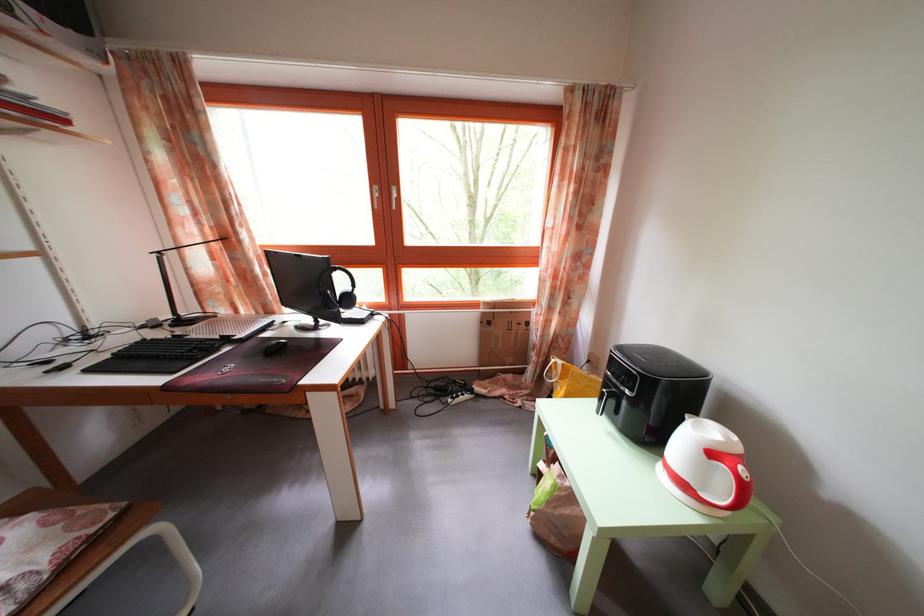
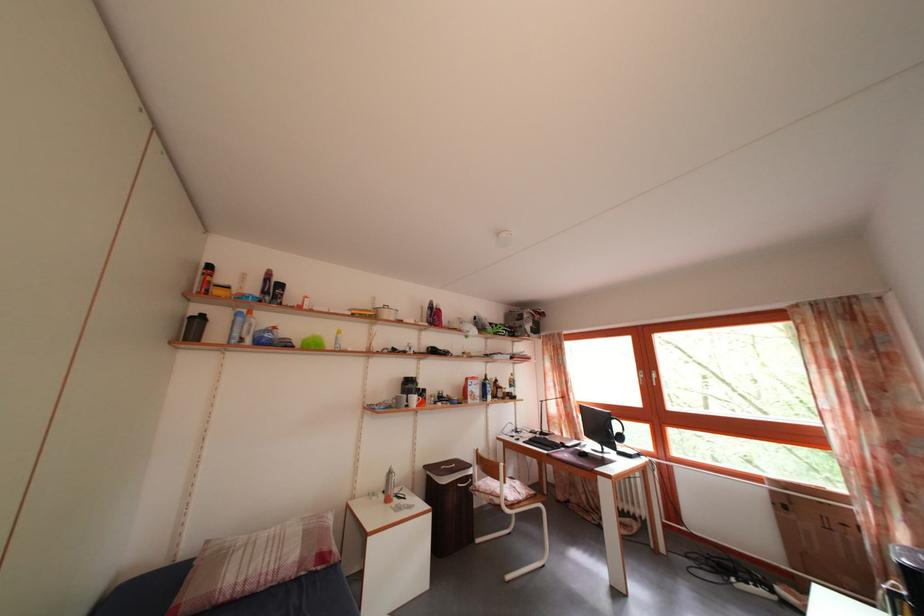
Question: I am providing you with two images of the same scene from different viewpoints. Please identify which objects are invisible in image2.

Choices:
 (A) white pot handle
 (B) trash can lid
 (C) computer mouse
 (D) none of these

Answer: (D)